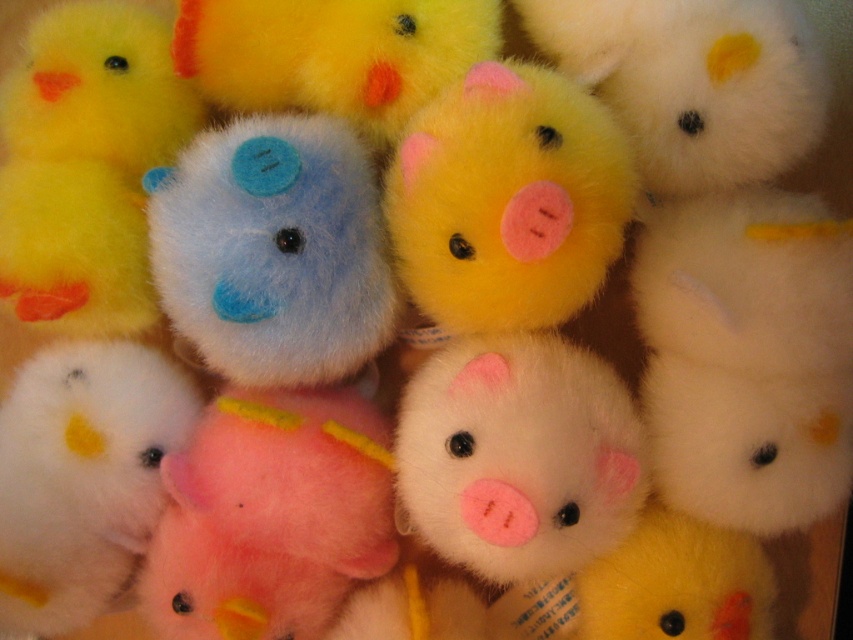
You are organizing a toy store shelf and need to arrange the pink fluffy pig at center and the yellow plush duck at center based on their sizes. Which toy should you place higher up to accommodate their height difference?

The pink fluffy pig at center should be placed higher up since it has a greater height compared to the yellow plush duck at center.

You are a child trying to reach for the yellow fuzzy pig at center and the fluffy blue bear at center in a toy box. Which toy is easier to grab first?

The fluffy blue bear at center is easier to grab first because the yellow fuzzy pig at center is behind it.

In the scene shown: You are organizing a childrens toy store and need to arrange the pink fluffy pig at center and the yellow plush duck at center on a shelf. According to the image, which toy should be placed to the left side of the shelf?

The pink fluffy pig at center should be placed to the left side of the shelf because it is to the left of the yellow plush duck at center in the image.